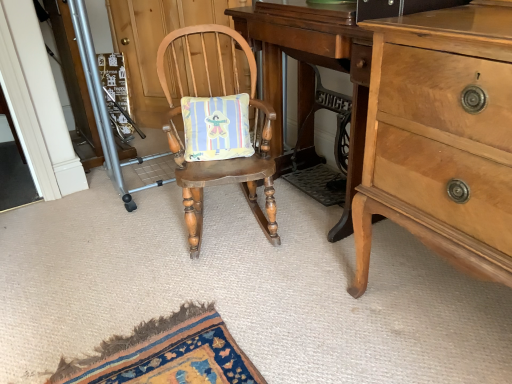
The width and height of the screenshot is (512, 384). I want to click on free spot in front of wooden rocking chair at center, so click(x=221, y=296).